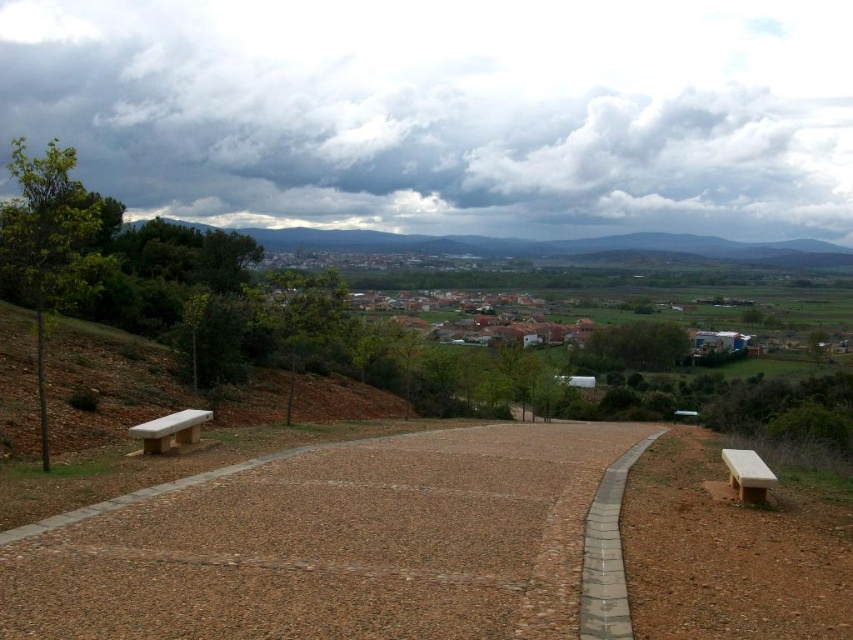
You are standing at the top of a hill overlooking the landscape. You notice two paths leading downwards towards the center of the image. One is a brown gravel path at center and the other is a gray concrete path at center. Which path would you walk down first if you want to reach the benches quickly?

The brown gravel path at center is closer to the viewer than the gray concrete path at center, so you would reach the benches faster by taking the brown gravel path at center first.